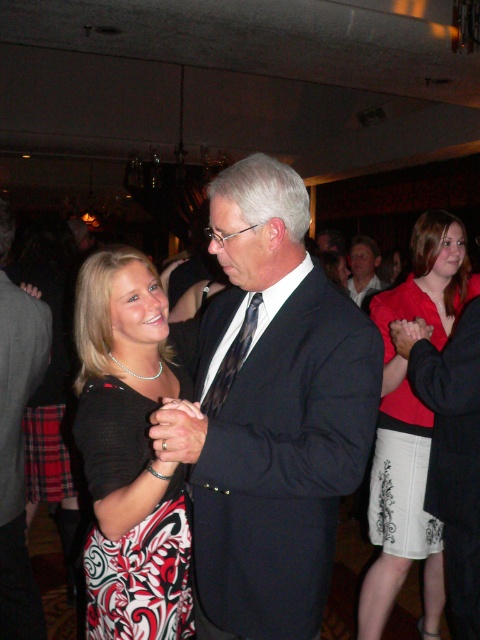
You are at a formal event and see two people dancing. One is wearing a matte red blouse at center and the other a dark gray suit at center. From the perspective of someone facing the dancers, which clothing item is positioned to the right?

The matte red blouse at center is positioned to the right of the dark gray suit at center.

Looking at this image, you are a photographer at this event and want to capture a closeup shot of both the black satin dress at center and dark gray suit at center. Given that your camera has a maximum focus range of 25 inches, will you be able to capture both subjects in focus without moving the camera?

The black satin dress at center and dark gray suit at center are 26.21 inches apart from each other, which exceeds the camera maximum focus range of 25 inches. Therefore, you cannot capture both subjects in focus without moving the camera.